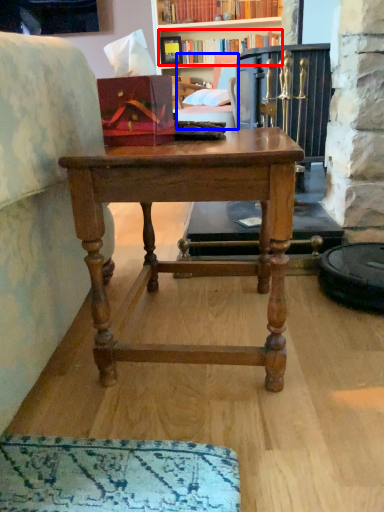
Question: Which of the following is the closest to the observer, book (highlighted by a red box) or swivel chair (highlighted by a blue box)?

Choices:
 (A) book
 (B) swivel chair

Answer: (B)